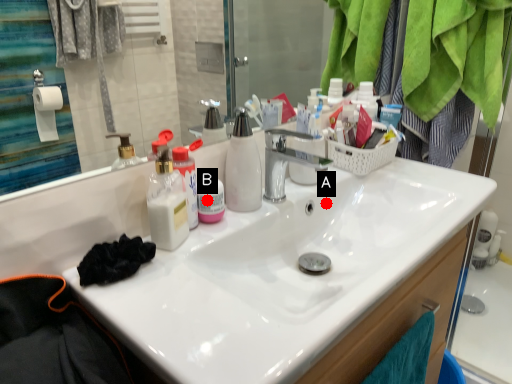
Question: Two points are circled on the image, labeled by A and B beside each circle. Among these points, which one is nearest to the camera?

Choices:
 (A) A is closer
 (B) B is closer

Answer: (B)